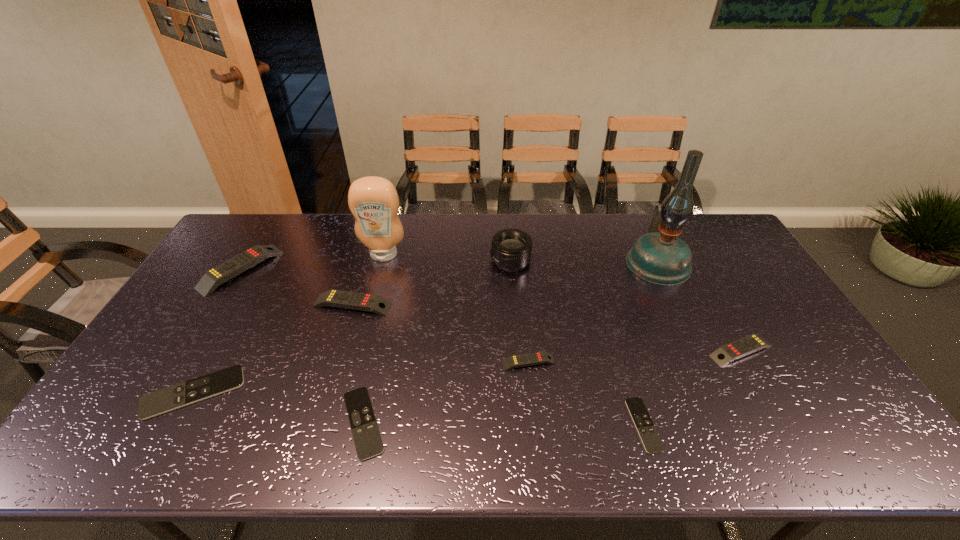
Where is `oil lamp`? Image resolution: width=960 pixels, height=540 pixels. oil lamp is located at coordinates (660, 257).

You are a GUI agent. You are given a task and a screenshot of the screen. Output one action in this format:
    pyautogui.click(x=<x>, y=<y>)
    Task: Click on the ninth shortest object
    
    Given the screenshot: What is the action you would take?
    pyautogui.click(x=373, y=201)

This screenshot has height=540, width=960. What are the coordinates of `telephoto lens` in the screenshot? It's located at (511, 249).

The height and width of the screenshot is (540, 960). What are the coordinates of `the leftmost yellow remote control` in the screenshot? It's located at (218, 275).

Locate an element on the screen. This screenshot has height=540, width=960. the biggest yellow remote control is located at coordinates (218, 275).

The image size is (960, 540). I want to click on the second biggest yellow remote control, so click(x=373, y=303).

Image resolution: width=960 pixels, height=540 pixels. What are the coordinates of `the second tallest remote control` in the screenshot? It's located at (373, 303).

Locate an element on the screen. This screenshot has height=540, width=960. the rightmost yellow remote control is located at coordinates (737, 349).

You are a GUI agent. You are given a task and a screenshot of the screen. Output one action in this format:
    pyautogui.click(x=<x>, y=<y>)
    Task: Click on the fifth shortest remote control
    This screenshot has height=540, width=960.
    Given the screenshot: What is the action you would take?
    pyautogui.click(x=737, y=349)

Where is `the fifth remote control from left to right`? This screenshot has height=540, width=960. the fifth remote control from left to right is located at coordinates (530, 359).